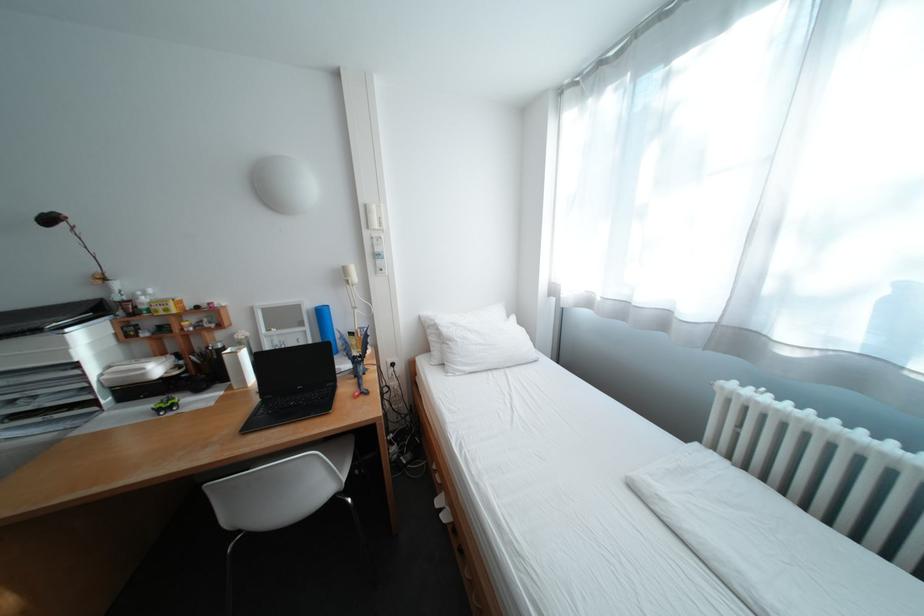
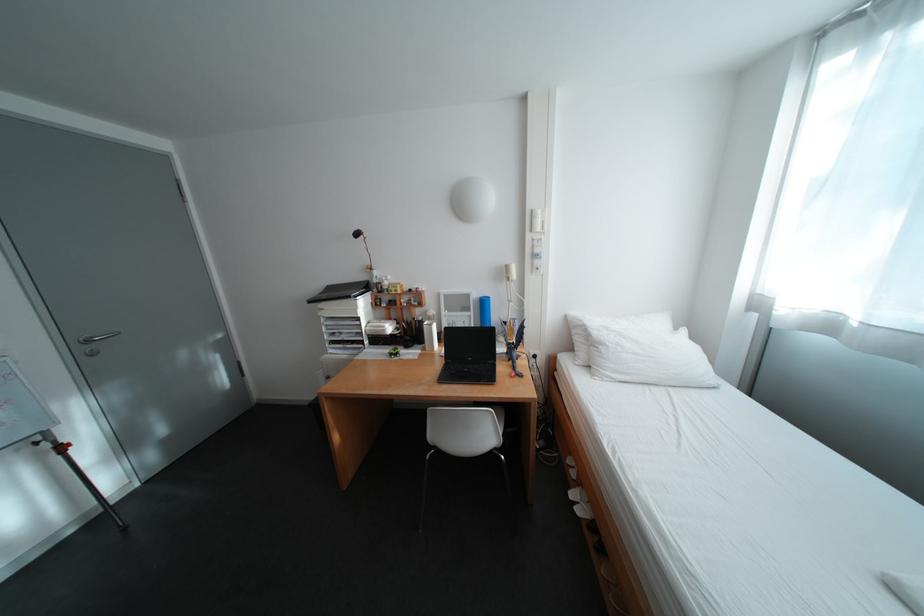
Where in the second image is the point corresponding to pixel 379 235 from the first image?

(541, 237)